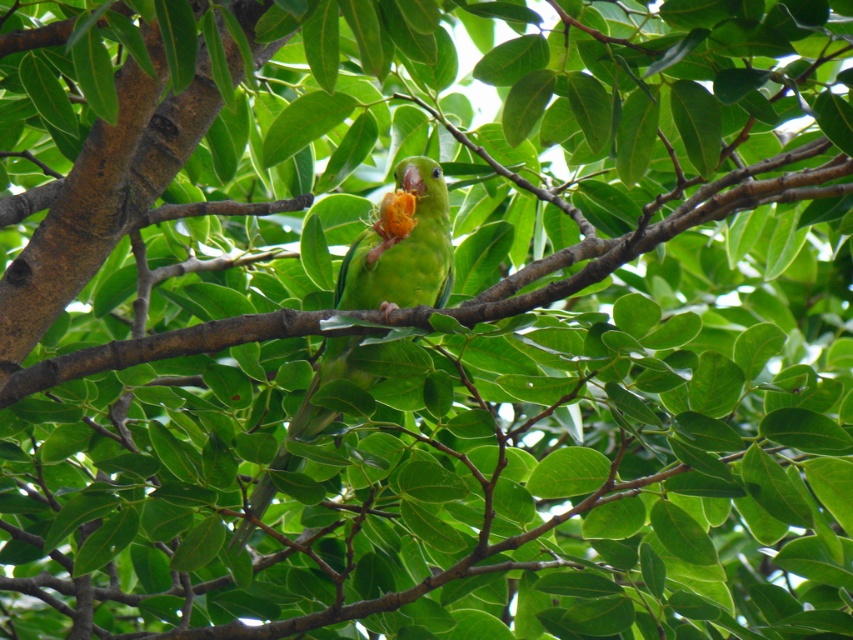
Can you confirm if brown rough tree branch at center is taller than green matte parrot at center?

No, brown rough tree branch at center is not taller than green matte parrot at center.

From the picture: Is brown rough tree branch at center to the left of green matte parrot at center from the viewer's perspective?

No, brown rough tree branch at center is not to the left of green matte parrot at center.

Which is in front, point (503, 296) or point (410, 195)?

Point (503, 296)

The width and height of the screenshot is (853, 640). Identify the location of brown rough tree branch at center. (659, 228).